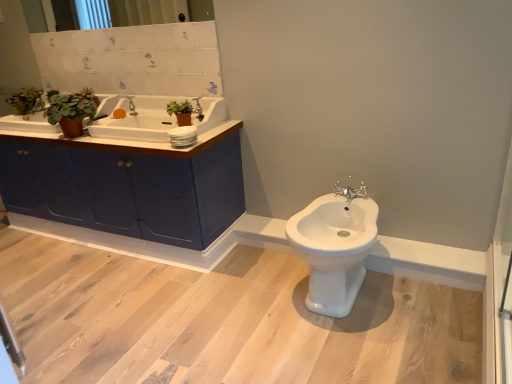
I want to click on free spot in front of silver metallic tap at upper center, which is the 2th tap in right-to-left order, so click(x=129, y=125).